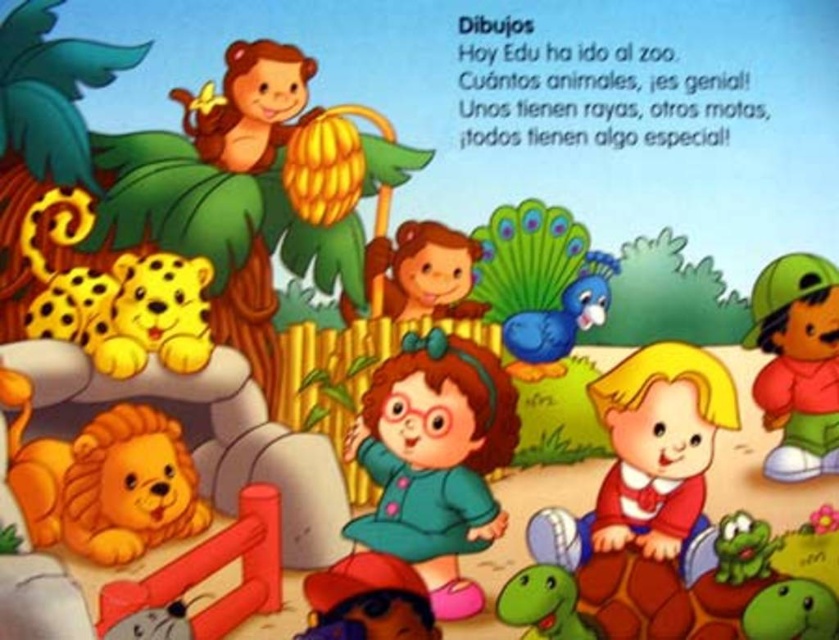
Does matte plastic toy at lower center have a larger size compared to matte brown monkey at upper left?

Correct, matte plastic toy at lower center is larger in size than matte brown monkey at upper left.

You are a GUI agent. You are given a task and a screenshot of the screen. Output one action in this format:
    pyautogui.click(x=<x>, y=<y>)
    Task: Click on the matte plastic toy at lower center
    
    Given the screenshot: What is the action you would take?
    pyautogui.click(x=368, y=600)

What do you see at coordinates (368, 600) in the screenshot?
I see `matte plastic toy at lower center` at bounding box center [368, 600].

In order to click on matte plastic toy at lower center in this screenshot , I will do `click(368, 600)`.

Is the position of yellow matte leopard at lower left less distant than that of matte brown monkey at upper left?

Yes, yellow matte leopard at lower left is closer to the viewer.

Between yellow matte leopard at lower left and matte brown monkey at upper left, which one has less height?

With less height is matte brown monkey at upper left.

Locate an element on the screen. The width and height of the screenshot is (839, 640). yellow matte leopard at lower left is located at coordinates (155, 316).

Does teal fabric dress at center have a lesser height compared to green rubber turtle at lower right?

No.

Does point (415, 385) lie in front of point (806, 616)?

No, it is not.

Who is more distant from viewer, (492,356) or (826,604)?

Positioned behind is point (492,356).

Image resolution: width=839 pixels, height=640 pixels. I want to click on teal fabric dress at center, so click(435, 460).